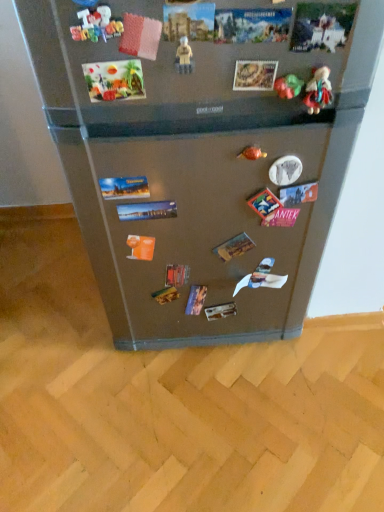
Where is `satin metallic fridge at center`? This screenshot has height=512, width=384. satin metallic fridge at center is located at coordinates (200, 158).

What do you see at coordinates (184, 56) in the screenshot?
I see `plastic beige figure at center, which appears as the 2th toy when viewed from the front` at bounding box center [184, 56].

Describe the element at coordinates (318, 90) in the screenshot. I see `multicolored fabric doll at upper right, which is the third toy in front-to-back order` at that location.

How much space does multicolored fabric doll at upper right, arranged as the third toy when viewed from the back, occupy horizontally?

multicolored fabric doll at upper right, arranged as the third toy when viewed from the back, is 0.82 inches in width.

How much space does green matte toy at upper right, marked as the fourth toy in a left-to-right arrangement, occupy horizontally?

The width of green matte toy at upper right, marked as the fourth toy in a left-to-right arrangement, is 0.92 inches.

The height and width of the screenshot is (512, 384). Find the location of `satin metallic fridge at center`. satin metallic fridge at center is located at coordinates (200, 158).

Considering the relative sizes of multicolored fabric doll at upper right, which is the third toy in front-to-back order, and metallic gold ring at center, which appears as the fifth toy when viewed from the front, in the image provided, is multicolored fabric doll at upper right, which is the third toy in front-to-back order, shorter than metallic gold ring at center, which appears as the fifth toy when viewed from the front,?

No, multicolored fabric doll at upper right, which is the third toy in front-to-back order, is not shorter than metallic gold ring at center, which appears as the fifth toy when viewed from the front.

Considering the relative sizes of multicolored fabric doll at upper right, marked as the 1th toy in a right-to-left arrangement, and metallic gold ring at center, placed as the third toy when sorted from left to right, in the image provided, is multicolored fabric doll at upper right, marked as the 1th toy in a right-to-left arrangement, bigger than metallic gold ring at center, placed as the third toy when sorted from left to right,?

Yes, multicolored fabric doll at upper right, marked as the 1th toy in a right-to-left arrangement, is bigger than metallic gold ring at center, placed as the third toy when sorted from left to right.

Based on their positions, is multicolored fabric doll at upper right, arranged as the third toy when viewed from the back, located to the left or right of metallic gold ring at center, which ranks as the first toy in back-to-front order?

multicolored fabric doll at upper right, arranged as the third toy when viewed from the back, is to the right of metallic gold ring at center, which ranks as the first toy in back-to-front order.

From a real-world perspective, is multicolored fabric doll at upper right, marked as the 1th toy in a right-to-left arrangement, above or below metallic gold ring at center, arranged as the third toy when viewed from the right?

multicolored fabric doll at upper right, marked as the 1th toy in a right-to-left arrangement, is above metallic gold ring at center, arranged as the third toy when viewed from the right.

From a real-world perspective, is multicolored fabric doll at upper right, the fifth toy viewed from the left, above or below plastic beige figure at center, the 4th toy viewed from the back?

In terms of real-world spatial position, multicolored fabric doll at upper right, the fifth toy viewed from the left, is below plastic beige figure at center, the 4th toy viewed from the back.

Who is more distant, multicolored fabric doll at upper right, the fifth toy viewed from the left, or plastic beige figure at center, which is the 2th toy in left-to-right order?

multicolored fabric doll at upper right, the fifth toy viewed from the left, is more distant.

In terms of height, does multicolored fabric doll at upper right, the fifth toy viewed from the left, look taller or shorter compared to plastic beige figure at center, acting as the fourth toy starting from the right?

In the image, multicolored fabric doll at upper right, the fifth toy viewed from the left, appears to be taller than plastic beige figure at center, acting as the fourth toy starting from the right.

Based on the photo, does multicolored fabric doll at upper right, which is the third toy in front-to-back order, have a smaller size compared to plastic beige figure at center, which is the 2th toy in left-to-right order?

Actually, multicolored fabric doll at upper right, which is the third toy in front-to-back order, might be larger than plastic beige figure at center, which is the 2th toy in left-to-right order.

Visually, is satin metallic fridge at center positioned to the left or to the right of rubberized plastic letters at upper left, the first toy positioned from the left?

Clearly, satin metallic fridge at center is on the right of rubberized plastic letters at upper left, the first toy positioned from the left, in the image.

From a real-world perspective, is satin metallic fridge at center above or below rubberized plastic letters at upper left, positioned as the 1th toy in front-to-back order?

satin metallic fridge at center is situated lower than rubberized plastic letters at upper left, positioned as the 1th toy in front-to-back order, in the real world.

Considering the relative sizes of satin metallic fridge at center and rubberized plastic letters at upper left, positioned as the 1th toy in front-to-back order, in the image provided, is satin metallic fridge at center bigger than rubberized plastic letters at upper left, positioned as the 1th toy in front-to-back order,?

Indeed, satin metallic fridge at center has a larger size compared to rubberized plastic letters at upper left, positioned as the 1th toy in front-to-back order.

Considering the positions of objects satin metallic fridge at center and green matte toy at upper right, the fourth toy viewed from the front, in the image provided, who is more to the left, satin metallic fridge at center or green matte toy at upper right, the fourth toy viewed from the front,?

Positioned to the left is satin metallic fridge at center.

You are a GUI agent. You are given a task and a screenshot of the screen. Output one action in this format:
    pyautogui.click(x=<x>, y=<y>)
    Task: Click on the 3rd toy behind the satin metallic fridge at center
    This screenshot has width=384, height=512.
    Given the screenshot: What is the action you would take?
    pyautogui.click(x=288, y=86)

Is metallic gold ring at center, placed as the third toy when sorted from left to right, facing away from multicolored fabric doll at upper right, which is the third toy in front-to-back order?

That's not correct — metallic gold ring at center, placed as the third toy when sorted from left to right, is not looking away from multicolored fabric doll at upper right, which is the third toy in front-to-back order.

From a real-world perspective, is metallic gold ring at center, which appears as the fifth toy when viewed from the front, physically above multicolored fabric doll at upper right, arranged as the third toy when viewed from the back?

No.

From the image's perspective, which is below, metallic gold ring at center, arranged as the third toy when viewed from the right, or multicolored fabric doll at upper right, marked as the 1th toy in a right-to-left arrangement?

metallic gold ring at center, arranged as the third toy when viewed from the right, from the image's perspective.

From the picture: Does metallic gold ring at center, which ranks as the first toy in back-to-front order, have a smaller size compared to multicolored fabric doll at upper right, which is the third toy in front-to-back order?

Correct, metallic gold ring at center, which ranks as the first toy in back-to-front order, occupies less space than multicolored fabric doll at upper right, which is the third toy in front-to-back order.

Which object is closer to the camera taking this photo, rubberized plastic letters at upper left, the 5th toy from the right, or multicolored fabric doll at upper right, the fifth toy viewed from the left?

rubberized plastic letters at upper left, the 5th toy from the right, is closer to the camera.

Which is behind, point (86, 37) or point (320, 71)?

Point (320, 71)

Considering the relative sizes of rubberized plastic letters at upper left, the 5th toy from the right, and multicolored fabric doll at upper right, arranged as the third toy when viewed from the back, in the image provided, is rubberized plastic letters at upper left, the 5th toy from the right, shorter than multicolored fabric doll at upper right, arranged as the third toy when viewed from the back,?

Yes.

From the multicolored fabric doll at upper right, marked as the 1th toy in a right-to-left arrangement, count 2nd toys forward and point to it. Please provide its 2D coordinates.

[(96, 25)]

Does satin metallic fridge at center touch metallic gold ring at center, arranged as the third toy when viewed from the right?

satin metallic fridge at center is not next to metallic gold ring at center, arranged as the third toy when viewed from the right, and they're not touching.

Does satin metallic fridge at center appear on the left side of metallic gold ring at center, which ranks as the first toy in back-to-front order?

Yes.

From a real-world perspective, does satin metallic fridge at center stand above metallic gold ring at center, placed as the third toy when sorted from left to right?

No, from a real-world perspective, satin metallic fridge at center is not over metallic gold ring at center, placed as the third toy when sorted from left to right

Locate an element on the screen. This screenshot has width=384, height=512. refrigerator located on the left of metallic gold ring at center, which ranks as the first toy in back-to-front order is located at coordinates (200, 158).

The image size is (384, 512). I want to click on the 2nd toy in front when counting from the metallic gold ring at center, placed as the third toy when sorted from left to right, so click(318, 90).

Identify the location of toy that is the 1st object located above the multicolored fabric doll at upper right, which is the third toy in front-to-back order (from the image's perspective). (184, 56).

Considering their positions, is multicolored fabric doll at upper right, the fifth toy viewed from the left, positioned further to plastic beige figure at center, the 4th toy viewed from the back, than satin metallic fridge at center?

Based on the image, satin metallic fridge at center appears to be further to plastic beige figure at center, the 4th toy viewed from the back.

Considering their positions, is metallic gold ring at center, arranged as the third toy when viewed from the right, positioned further to satin metallic fridge at center than green matte toy at upper right, marked as the 2th toy in a right-to-left arrangement?

Among the two, green matte toy at upper right, marked as the 2th toy in a right-to-left arrangement, is located further to satin metallic fridge at center.

When comparing their distances from metallic gold ring at center, arranged as the third toy when viewed from the right, does satin metallic fridge at center or plastic beige figure at center, which appears as the 2th toy when viewed from the front, seem closer?

plastic beige figure at center, which appears as the 2th toy when viewed from the front, lies closer to metallic gold ring at center, arranged as the third toy when viewed from the right, than the other object.

Based on their spatial positions, is green matte toy at upper right, which is counted as the second toy, starting from the back, or satin metallic fridge at center further from rubberized plastic letters at upper left, the first toy positioned from the left?

satin metallic fridge at center.

Which object lies nearer to the anchor point rubberized plastic letters at upper left, the 5th toy from the right, satin metallic fridge at center or multicolored fabric doll at upper right, marked as the 1th toy in a right-to-left arrangement?

Based on the image, multicolored fabric doll at upper right, marked as the 1th toy in a right-to-left arrangement, appears to be nearer to rubberized plastic letters at upper left, the 5th toy from the right.

Which object lies nearer to the anchor point green matte toy at upper right, the fourth toy viewed from the front, rubberized plastic letters at upper left, positioned as the 1th toy in front-to-back order, or satin metallic fridge at center?

Based on the image, rubberized plastic letters at upper left, positioned as the 1th toy in front-to-back order, appears to be nearer to green matte toy at upper right, the fourth toy viewed from the front.

From the image, which object appears to be nearer to green matte toy at upper right, the fourth toy viewed from the front, multicolored fabric doll at upper right, which is the third toy in front-to-back order, or rubberized plastic letters at upper left, the first toy positioned from the left?

Result: Among the two, multicolored fabric doll at upper right, which is the third toy in front-to-back order, is located nearer to green matte toy at upper right, the fourth toy viewed from the front.

Looking at the image, which one is located closer to metallic gold ring at center, placed as the third toy when sorted from left to right, green matte toy at upper right, marked as the 2th toy in a right-to-left arrangement, or multicolored fabric doll at upper right, which is the third toy in front-to-back order?

green matte toy at upper right, marked as the 2th toy in a right-to-left arrangement, is closer to metallic gold ring at center, placed as the third toy when sorted from left to right.

This screenshot has height=512, width=384. Find the location of `refrigerator situated between rubberized plastic letters at upper left, the first toy positioned from the left, and multicolored fabric doll at upper right, the fifth toy viewed from the left, from left to right`. refrigerator situated between rubberized plastic letters at upper left, the first toy positioned from the left, and multicolored fabric doll at upper right, the fifth toy viewed from the left, from left to right is located at coordinates (200, 158).

I want to click on toy between multicolored fabric doll at upper right, marked as the 1th toy in a right-to-left arrangement, and metallic gold ring at center, placed as the third toy when sorted from left to right, from front to back, so pyautogui.click(x=288, y=86).

Where is `refrigerator between rubberized plastic letters at upper left, marked as the fifth toy in a back-to-front arrangement, and green matte toy at upper right, the fourth toy viewed from the front, from left to right`? Image resolution: width=384 pixels, height=512 pixels. refrigerator between rubberized plastic letters at upper left, marked as the fifth toy in a back-to-front arrangement, and green matte toy at upper right, the fourth toy viewed from the front, from left to right is located at coordinates (200, 158).

Where is `toy between green matte toy at upper right, marked as the 2th toy in a right-to-left arrangement, and satin metallic fridge at center in the up-down direction`? The width and height of the screenshot is (384, 512). toy between green matte toy at upper right, marked as the 2th toy in a right-to-left arrangement, and satin metallic fridge at center in the up-down direction is located at coordinates (252, 153).